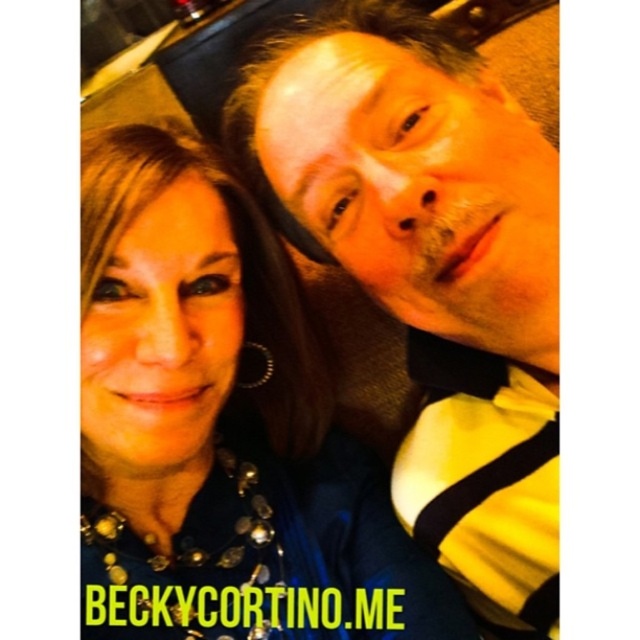
Who is positioned more to the right, blue fabric at center or yellow striped shirt at upper right?

yellow striped shirt at upper right

Is blue fabric at center taller than yellow striped shirt at upper right?

No.

Who is more distant from viewer, (205, 384) or (536, 314)?

The point (205, 384) is behind.

Find the location of a particular element. blue fabric at center is located at coordinates (220, 428).